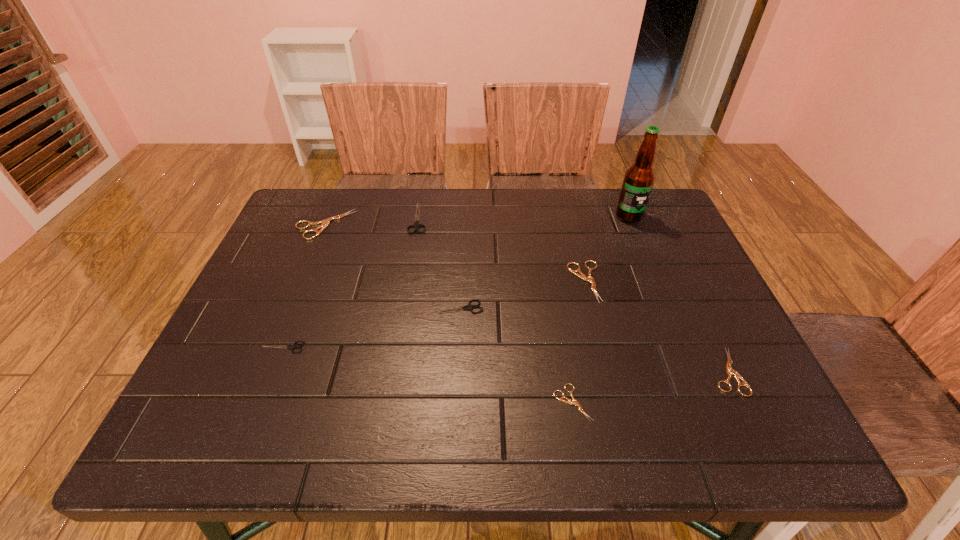
Where is `beer bottle`? The width and height of the screenshot is (960, 540). beer bottle is located at coordinates (639, 178).

You are a GUI agent. You are given a task and a screenshot of the screen. Output one action in this format:
    pyautogui.click(x=<x>, y=<y>)
    Task: Click on the tallest object
    
    Given the screenshot: What is the action you would take?
    pyautogui.click(x=639, y=178)

Where is `the second black shears from left to right`? The width and height of the screenshot is (960, 540). the second black shears from left to right is located at coordinates (416, 225).

Find the location of a particular element. the farthest black shears is located at coordinates (416, 225).

Locate an element on the screen. the leftmost beige shears is located at coordinates (324, 223).

I want to click on the farthest beige shears, so click(x=324, y=223).

What are the coordinates of `the fourth shears from right to left` in the screenshot? It's located at (469, 307).

I want to click on the rightmost black shears, so click(x=469, y=307).

Locate an element on the screen. the second beige shears from right to left is located at coordinates (575, 272).

Find the location of `the third smallest beige shears`. the third smallest beige shears is located at coordinates (575, 272).